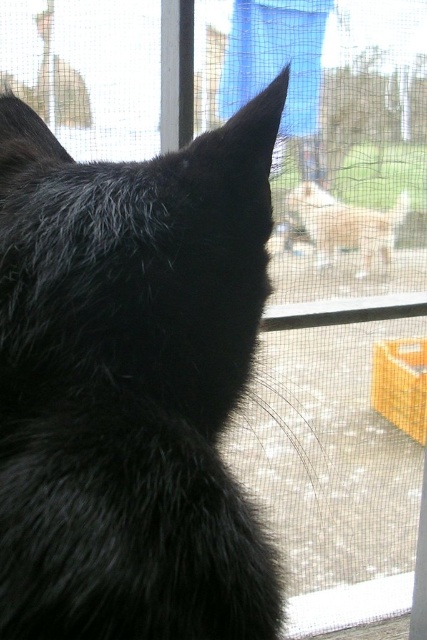
You are a photographer trying to capture a clear photo of the black fluffy cat at left through the screen door. Considering the screen door has a fine mesh texture, will the mesh obstruct the cat or the dog in the background?

The black fluffy cat at left is 14.39 inches from camera, so the mesh will obstruct the cat more clearly than the dog in the background because the cat is closer to the camera.

You are trying to determine if the black fluffy cat at left can fit through the white mesh screen at lower center. Based on their sizes, can the cat pass through?

The black fluffy cat at left has a larger size compared to the white mesh screen at lower center, so it cannot pass through the screen.

You are a photographer trying to capture a shot of the black fluffy cat at left through the screen door. The screen door has a fine mesh that might obstruct the view. Based on the cat position, where should you aim your camera to ensure the cat is centered in the photo?

To center the black fluffy cat at left in the photo, aim your camera at the 2D coordinates point mentioned in the description, which is at point (131,384). This will ensure the cat is positioned correctly despite the screen door mesh.